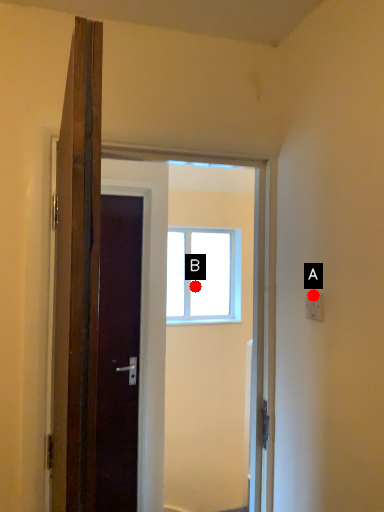
Question: Two points are circled on the image, labeled by A and B beside each circle. Which point is closer to the camera taking this photo?

Choices:
 (A) A is closer
 (B) B is closer

Answer: (A)